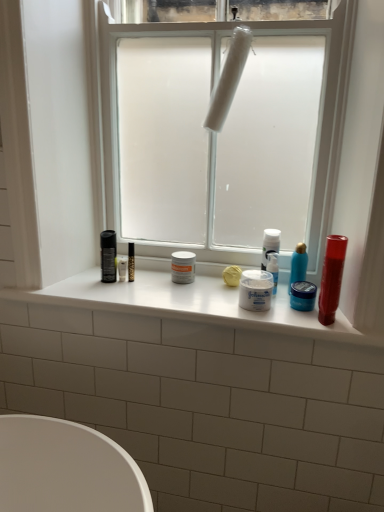
I want to click on vacant space positioned to the left of blue matte jar at center, the second toiletry when ordered from right to left, so click(x=258, y=309).